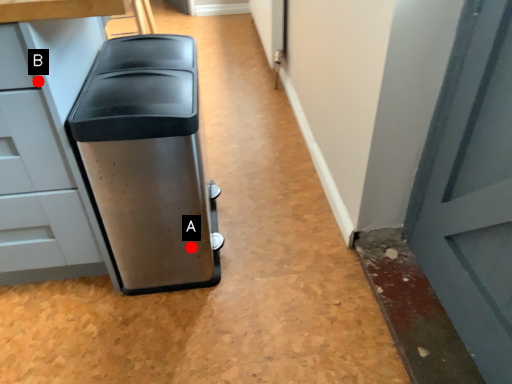
Question: Two points are circled on the image, labeled by A and B beside each circle. Which point appears closest to the camera in this image?

Choices:
 (A) A is closer
 (B) B is closer

Answer: (B)